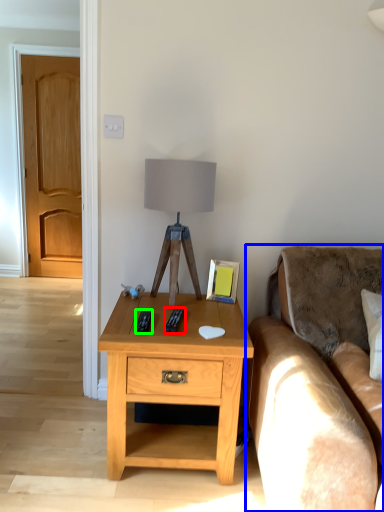
Question: Estimate the real-world distances between objects in this image. Which object is closer to remote (highlighted by a red box), studio couch (highlighted by a blue box) or remote (highlighted by a green box)?

Choices:
 (A) studio couch
 (B) remote

Answer: (B)